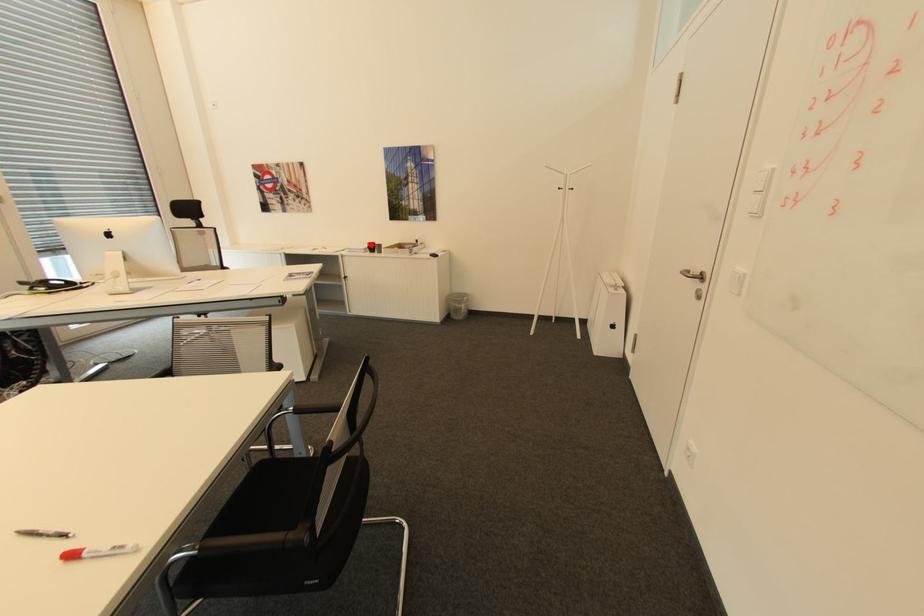
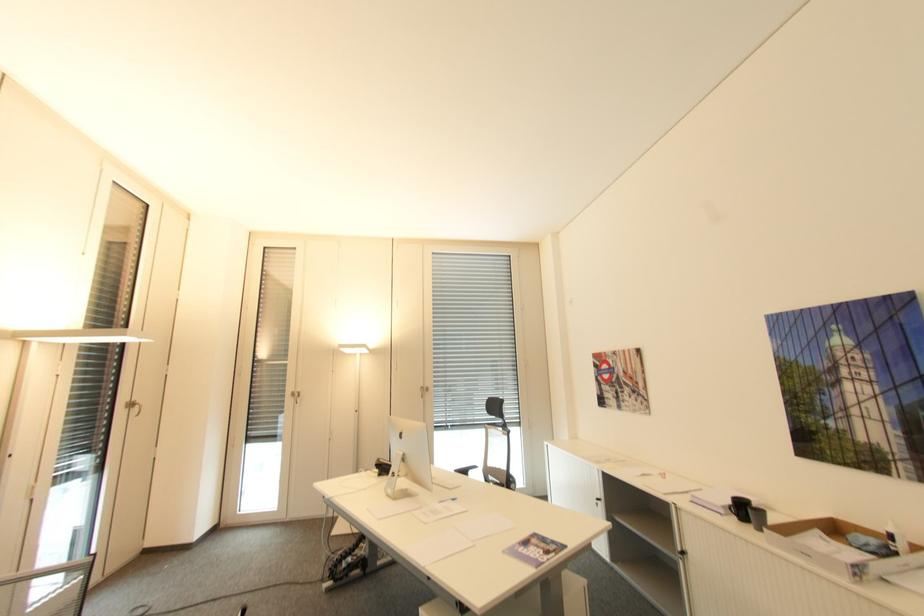
Locate, in the second image, the point that corresponds to the highlighted location in the first image.

(734, 501)